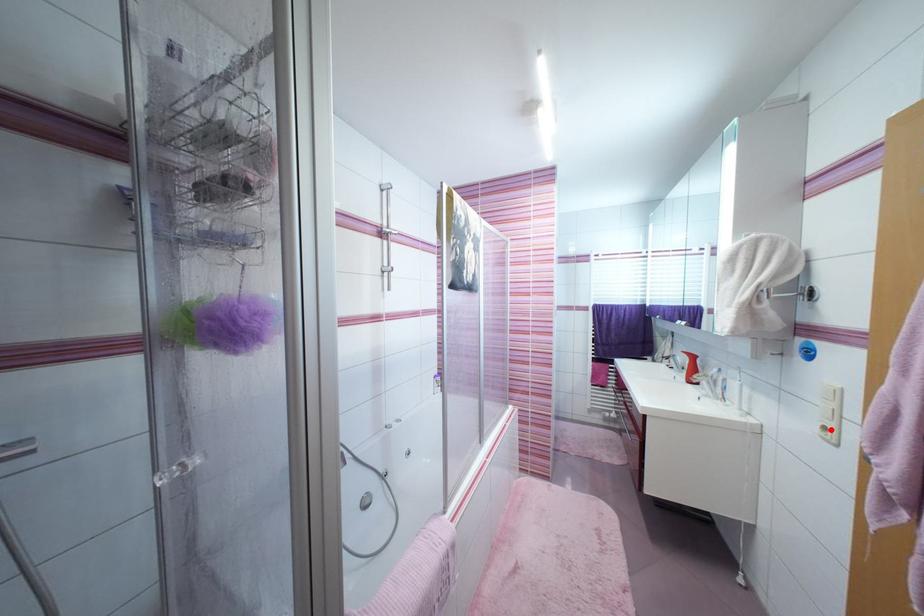
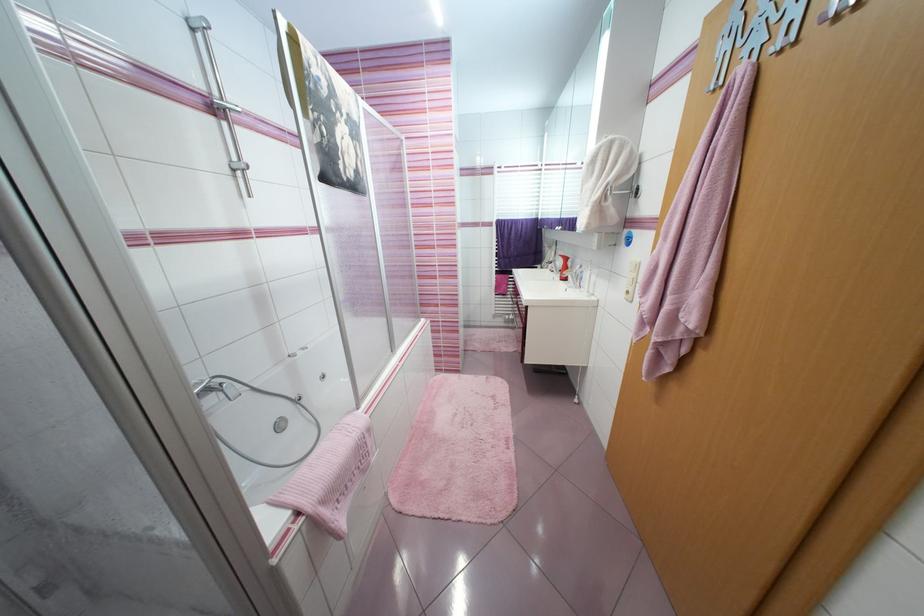
Locate, in the second image, the point that corresponds to the highlighted location in the first image.

(633, 293)